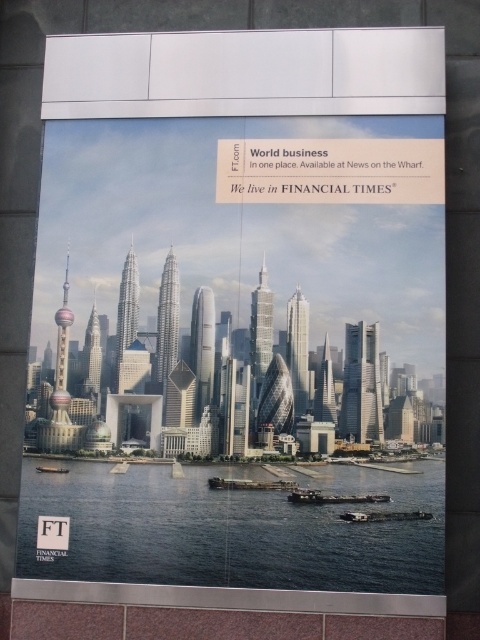
You are an architect analyzing the layout of the cityscape in the advertisement poster. There are two points marked on the poster at coordinates point (381, 220) and point (370, 520). Which point is positioned further back in the 3D space of the poster?

Point (381, 220) is behind point (370, 520) in the 3D space of the poster.

You are standing on the shore looking at the image. Which object is higher up in the scene between the metallic glass skyscrapers at center and the metallic gray boat at lower center?

The metallic glass skyscrapers at center are higher up in the scene because they are located above the metallic gray boat at lower center.

You are standing in front of the advertisement poster and notice the metallic glass skyscrapers at center and the metallic gray boat at lower left. Which object is positioned higher in the image?

The metallic glass skyscrapers at center are positioned higher than the metallic gray boat at lower left in the image.